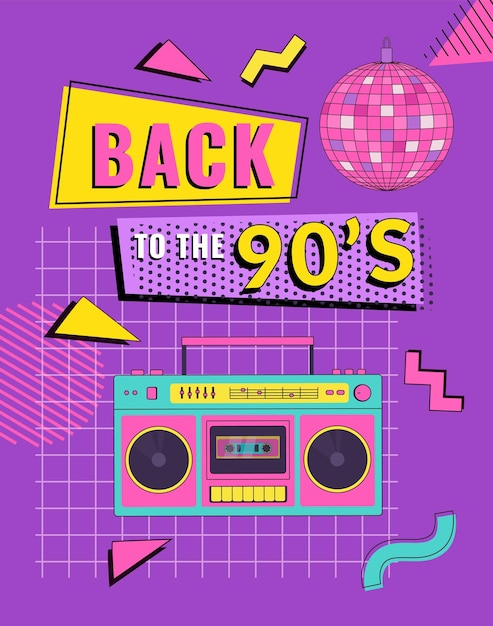
In order to click on boombox in this screenshot , I will do `click(135, 409)`.